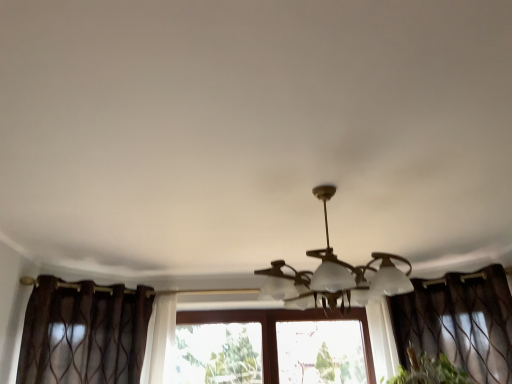
What is the approximate width of brown sheer curtain at right, which ranks as the second curtain in left-to-right order?

brown sheer curtain at right, which ranks as the second curtain in left-to-right order, is 37.54 centimeters in width.

This screenshot has width=512, height=384. What do you see at coordinates (459, 322) in the screenshot?
I see `brown sheer curtain at right, which is the first curtain from right to left` at bounding box center [459, 322].

Where is `brown sheer curtain at right, which ranks as the second curtain in left-to-right order`? brown sheer curtain at right, which ranks as the second curtain in left-to-right order is located at coordinates [459, 322].

Considering the positions of objects brown sheer curtain at right, which is the first curtain from right to left, and brown sheer curtain at left, arranged as the first curtain when viewed from the left, in the image provided, who is in front, brown sheer curtain at right, which is the first curtain from right to left, or brown sheer curtain at left, arranged as the first curtain when viewed from the left,?

brown sheer curtain at left, arranged as the first curtain when viewed from the left, is closer to the camera.

How different are the orientations of brown sheer curtain at right, which ranks as the second curtain in left-to-right order, and brown sheer curtain at left, positioned as the second curtain in right-to-left order, in degrees?

There is a 80.9-degree angle between the facing directions of brown sheer curtain at right, which ranks as the second curtain in left-to-right order, and brown sheer curtain at left, positioned as the second curtain in right-to-left order.

Which of these two, brown sheer curtain at right, which ranks as the second curtain in left-to-right order, or brown sheer curtain at left, positioned as the second curtain in right-to-left order, stands shorter?

With less height is brown sheer curtain at left, positioned as the second curtain in right-to-left order.

Is brown sheer curtain at right, which is the first curtain from right to left, located outside brown sheer curtain at left, arranged as the first curtain when viewed from the left?

That's correct, brown sheer curtain at right, which is the first curtain from right to left, is outside of brown sheer curtain at left, arranged as the first curtain when viewed from the left.

Is brown sheer curtain at right, which ranks as the second curtain in left-to-right order, aimed at matte white lamp at center?

Yes, brown sheer curtain at right, which ranks as the second curtain in left-to-right order, is aimed at matte white lamp at center.

Looking at the image, does brown sheer curtain at right, which ranks as the second curtain in left-to-right order, seem bigger or smaller compared to matte white lamp at center?

In the image, brown sheer curtain at right, which ranks as the second curtain in left-to-right order, appears to be smaller than matte white lamp at center.

How different are the orientations of brown sheer curtain at right, which ranks as the second curtain in left-to-right order, and matte white lamp at center in degrees?

brown sheer curtain at right, which ranks as the second curtain in left-to-right order, and matte white lamp at center are facing 53.5 degrees away from each other.

In the image, is brown sheer curtain at right, which ranks as the second curtain in left-to-right order, on the left side or the right side of matte white lamp at center?

In the image, brown sheer curtain at right, which ranks as the second curtain in left-to-right order, appears on the right side of matte white lamp at center.

Which is further, (63, 354) or (272, 276)?

The point (63, 354) is farther.

From the image's perspective, which object appears higher, brown sheer curtain at left, positioned as the second curtain in right-to-left order, or matte white lamp at center?

From the image's view, matte white lamp at center is above.

Looking at the image, does brown sheer curtain at left, positioned as the second curtain in right-to-left order, seem bigger or smaller compared to matte white lamp at center?

In the image, brown sheer curtain at left, positioned as the second curtain in right-to-left order, appears to be smaller than matte white lamp at center.

Based on the photo, is brown sheer curtain at left, arranged as the first curtain when viewed from the left, facing away from matte white lamp at center?

brown sheer curtain at left, arranged as the first curtain when viewed from the left, does not have its back to matte white lamp at center.

Which is more to the left, brown sheer curtain at left, positioned as the second curtain in right-to-left order, or brown sheer curtain at right, which is the first curtain from right to left?

brown sheer curtain at left, positioned as the second curtain in right-to-left order.

Is brown sheer curtain at left, arranged as the first curtain when viewed from the left, aimed at brown sheer curtain at right, which is the first curtain from right to left?

No.

Is matte white lamp at center facing towards brown sheer curtain at right, which is the first curtain from right to left?

No, matte white lamp at center does not turn towards brown sheer curtain at right, which is the first curtain from right to left.

Between matte white lamp at center and brown sheer curtain at right, which ranks as the second curtain in left-to-right order, which one has larger size?

matte white lamp at center is bigger.

Considering the relative positions of matte white lamp at center and brown sheer curtain at right, which is the first curtain from right to left, in the image provided, is matte white lamp at center to the right of brown sheer curtain at right, which is the first curtain from right to left, from the viewer's perspective?

In fact, matte white lamp at center is to the left of brown sheer curtain at right, which is the first curtain from right to left.

Is point (371, 285) closer to viewer compared to point (432, 293)?

That is True.

Can you confirm if matte white lamp at center is taller than brown sheer curtain at left, arranged as the first curtain when viewed from the left?

Incorrect, the height of matte white lamp at center is not larger of that of brown sheer curtain at left, arranged as the first curtain when viewed from the left.

Looking at this image, which point is more forward, (360,293) or (62,361)?

Positioned in front is point (360,293).

Are matte white lamp at center and brown sheer curtain at left, arranged as the first curtain when viewed from the left, far apart?

Yes, matte white lamp at center and brown sheer curtain at left, arranged as the first curtain when viewed from the left, are quite far apart.

Image resolution: width=512 pixels, height=384 pixels. I want to click on curtain behind the brown sheer curtain at left, arranged as the first curtain when viewed from the left, so click(x=459, y=322).

From the image's perspective, starting from the matte white lamp at center, which curtain is the 1st one below? Please provide its 2D coordinates.

[(459, 322)]

In the scene shown: From the image, which object appears to be nearer to matte white lamp at center, brown sheer curtain at left, arranged as the first curtain when viewed from the left, or brown sheer curtain at right, which is the first curtain from right to left?

brown sheer curtain at right, which is the first curtain from right to left.

Considering their positions, is matte white lamp at center positioned closer to brown sheer curtain at right, which ranks as the second curtain in left-to-right order, than brown sheer curtain at left, positioned as the second curtain in right-to-left order?

matte white lamp at center lies closer to brown sheer curtain at right, which ranks as the second curtain in left-to-right order, than the other object.

In the scene shown: Considering their positions, is brown sheer curtain at left, positioned as the second curtain in right-to-left order, positioned closer to brown sheer curtain at right, which is the first curtain from right to left, than matte white lamp at center?

The object closer to brown sheer curtain at right, which is the first curtain from right to left, is matte white lamp at center.

Considering their positions, is brown sheer curtain at right, which ranks as the second curtain in left-to-right order, positioned further to brown sheer curtain at left, arranged as the first curtain when viewed from the left, than matte white lamp at center?

Based on the image, brown sheer curtain at right, which ranks as the second curtain in left-to-right order, appears to be further to brown sheer curtain at left, arranged as the first curtain when viewed from the left.

When comparing their distances from matte white lamp at center, does brown sheer curtain at right, which ranks as the second curtain in left-to-right order, or brown sheer curtain at left, arranged as the first curtain when viewed from the left, seem further?

brown sheer curtain at left, arranged as the first curtain when viewed from the left, is further to matte white lamp at center.

Considering their positions, is matte white lamp at center positioned further to brown sheer curtain at left, arranged as the first curtain when viewed from the left, than brown sheer curtain at right, which is the first curtain from right to left?

brown sheer curtain at right, which is the first curtain from right to left, is positioned further to the anchor brown sheer curtain at left, arranged as the first curtain when viewed from the left.

Identify the location of lamp between brown sheer curtain at left, arranged as the first curtain when viewed from the left, and brown sheer curtain at right, which ranks as the second curtain in left-to-right order, in the horizontal direction. Image resolution: width=512 pixels, height=384 pixels. (335, 275).